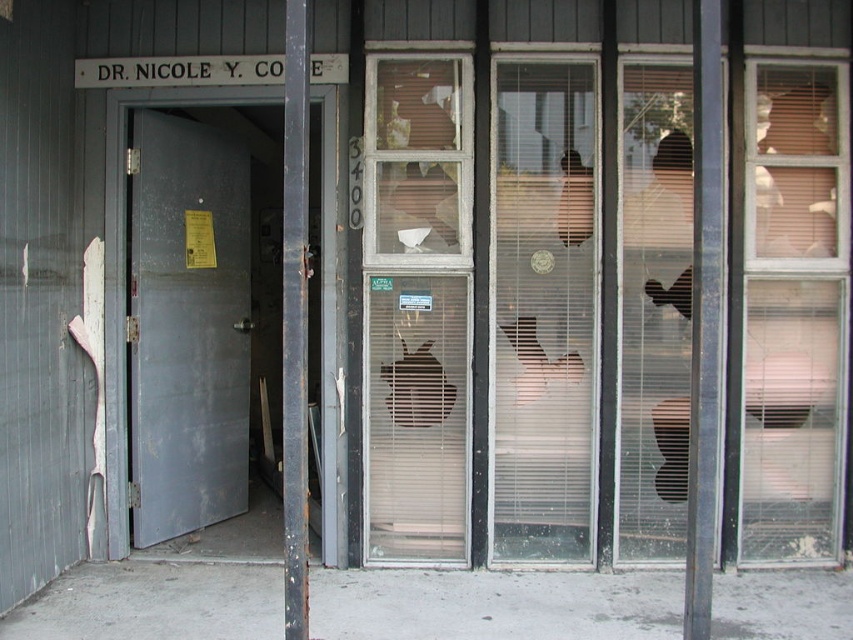
Can you confirm if clear glass window at right is shorter than white painted wood sign at upper center?

In fact, clear glass window at right may be taller than white painted wood sign at upper center.

Measure the distance between clear glass window at right and camera.

clear glass window at right and camera are 15.72 feet apart.

Image resolution: width=853 pixels, height=640 pixels. What are the coordinates of `clear glass window at right` in the screenshot? It's located at (793, 310).

Between clear glass window at right and clear glass window at center, which one is positioned lower?

clear glass window at right is below.

Measure the distance between clear glass window at right and camera.

clear glass window at right is 4.79 meters away from camera.

Is point (761, 145) positioned in front of point (560, 273)?

No.

I want to click on clear glass window at right, so click(x=793, y=310).

Is metallic gray door at left positioned behind white painted wood sign at upper center?

Yes, it is behind white painted wood sign at upper center.

Who is positioned more to the right, metallic gray door at left or white painted wood sign at upper center?

white painted wood sign at upper center is more to the right.

Is point (178, 301) in front of point (78, 67)?

No, it is behind (78, 67).

You are a GUI agent. You are given a task and a screenshot of the screen. Output one action in this format:
    pyautogui.click(x=<x>, y=<y>)
    Task: Click on the metallic gray door at left
    
    Given the screenshot: What is the action you would take?
    pyautogui.click(x=187, y=324)